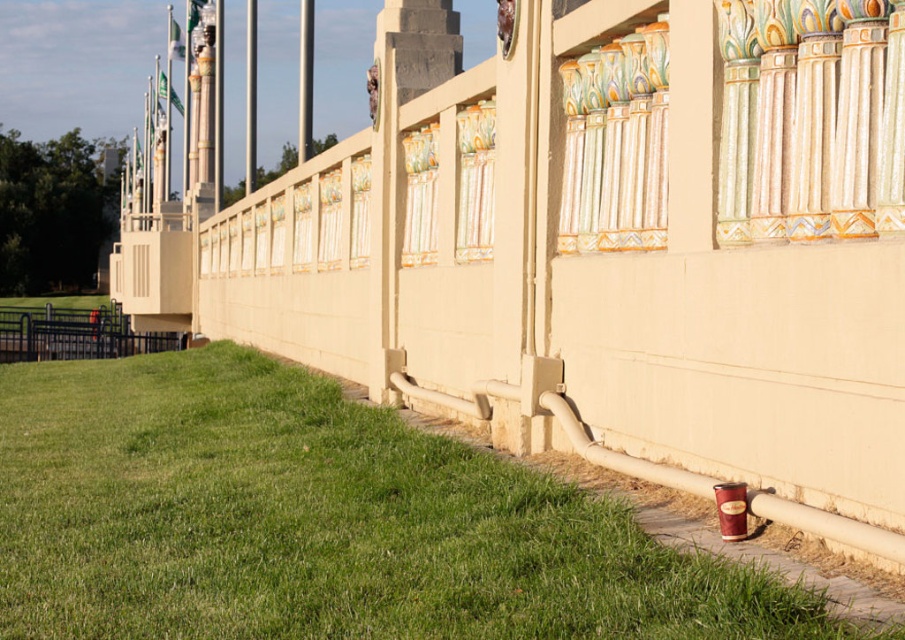
Consider the image. You are standing at the origin point of the coordinate system where the wall is at the top right. You need to locate the green grass at lower left. What are its coordinates?

The coordinates of the green grass at lower left are at point [319,522].

You are standing in front of the wall with columns and want to walk towards the green grass at lower left. Which direction should you move relative to the black metal fence at lower left?

The green grass at lower left is to the right of the black metal fence at lower left, so you should move to the right of the black metal fence at lower left to reach the green grass at lower left.